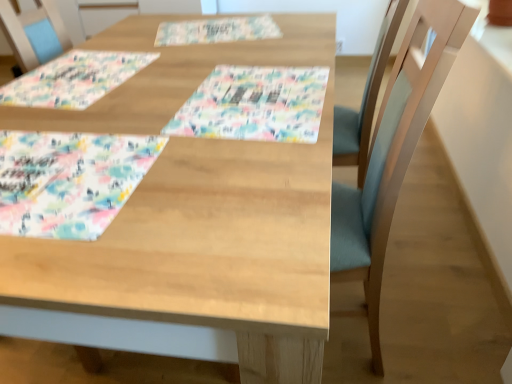
Question: From a real-world perspective, relative to watercolor fabric placemat at center, is floral paper placemat at upper center, the 3th place mat from the bottom, vertically above or below?

Choices:
 (A) above
 (B) below

Answer: (B)

Question: Is floral paper placemat at upper center, which is counted as the third place mat, starting from the front, taller or shorter than watercolor fabric placemat at center?

Choices:
 (A) short
 (B) tall

Answer: (A)

Question: Estimate the real-world distances between objects in this image. Which object is closer to the floral paper placemat at upper center, which is counted as the 1th place mat, starting from the back?

Choices:
 (A) pastel floral fabric placemat at lower left, the 3th place mat from the top
 (B) pastel floral fabric placemat at upper left, which ranks as the second place mat in back-to-front order
 (C) watercolor fabric placemat at center
 (D) wooden table at center

Answer: (B)

Question: Considering the real-world distances, which object is closest to the wooden table at center?

Choices:
 (A) pastel floral fabric placemat at lower left, the 3th place mat from the top
 (B) floral paper placemat at upper center, which is counted as the third place mat, starting from the front
 (C) watercolor fabric placemat at center
 (D) pastel floral fabric placemat at upper left, the second place mat in the bottom-to-top sequence

Answer: (A)